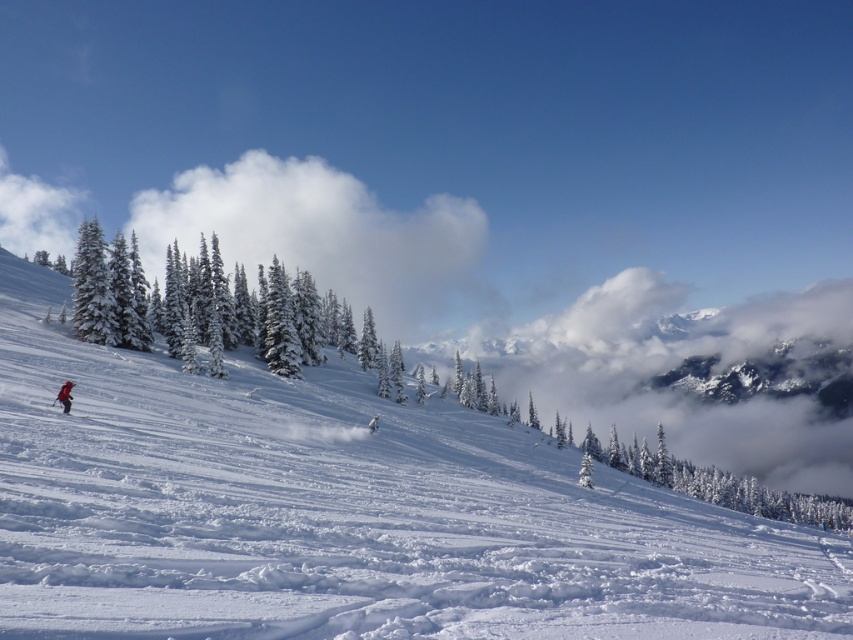
Looking at this image, you are a photographer standing at the bottom of the slope and want to take a photo of the white fluffy cloud at upper center and the red fabric backpack at lower left. Which object will appear closer to you in the photo?

The white fluffy cloud at upper center will appear closer to you in the photo because it is positioned further to the viewer than the red fabric backpack at lower left.

You are navigating a drone through the winter landscape shown in the image. You need to fly from point A to point B. Given that point A is at point (33, 433) and point B is at point (297, 161), will you pass closer to the skier dressed in red and black first before reaching the distant mountains?

Point (33, 433) is in front of point (297, 161), so when flying from point A to point B, you will first pass closer to the skier dressed in red and black before reaching the distant mountains.